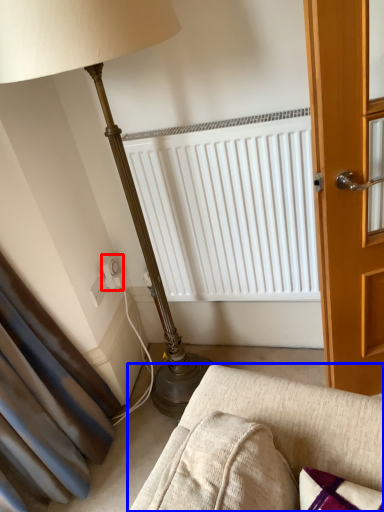
Question: Which object appears farthest to the camera in this image, electric outlet (highlighted by a red box) or studio couch (highlighted by a blue box)?

Choices:
 (A) electric outlet
 (B) studio couch

Answer: (A)